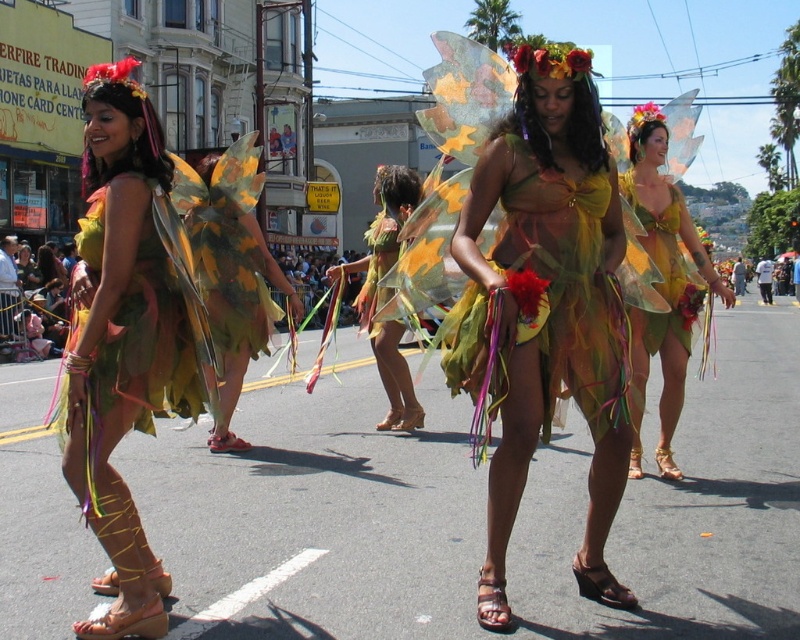
Consider the image. You are organizing a parade float and need to decide which of the two pairs of wings, the matte green leaf wings at center or the camouflage fabric wings at center, will fit better on a narrow platform. Based on their sizes, which one would you choose?

The matte green leaf wings at center has a smaller width compared to the camouflage fabric wings at center, so it would fit better on a narrow platform.

You are a photographer standing at the center of the street, and you want to take a photo of both the point at (537, 232) and the point at (72, 317). Which point is closer to your camera lens?

Point at (72, 317) is closer to the camera lens because it is less further to the viewer than point at (537, 232).

You are a photographer positioned at the origin point of the scene. You need to capture a photo of the shiny gold dress at center. If the camera can only focus on objects within a 0.5 unit radius from your position, will the dress be in focus?

The shiny gold dress at center is located at point [544,307]. The distance from the origin to this point is sqrt0.481 squared plus 0.681 squared, which is approximately sqrt0.231 plus 0.464 equals sqrt0.695 equals approximately 0.833 units. Since 0.833 is greater than 0.5, the dress will not be in focus.